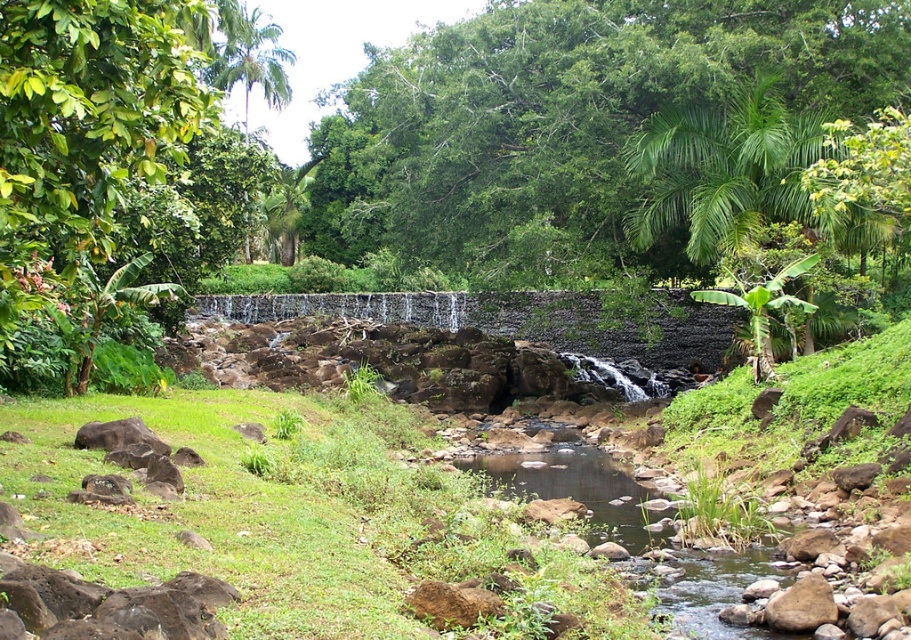
You are standing at the center of the image and want to locate the green leafy tree at upper left. In which direction should you look to find it?

The green leafy tree at upper left is located at point coordinates of 0.256 on the x axis and 0.092 on the y axis. Since the x value is less than 0.5, it is to the left of the center. The y value is also less than 0.5, meaning it is above the center. Therefore, you should look towards the upper left direction to find it.

You are an artist sketching this scene and want to emphasize the scale differences between the green leafy tree at upper center and the green leafy tree at upper left. Which tree should you draw larger in your sketch?

The green leafy tree at upper center should be drawn larger because it is larger in size than the green leafy tree at upper left according to the description.

You are standing in the natural scene and want to take a photo of both the green leafy tree at upper left and the gray stone waterfall at center. Which object should you adjust your camera focus on to ensure both are in sharp focus?

To ensure both the green leafy tree at upper left and the gray stone waterfall at center are in sharp focus, you should focus on the green leafy tree at upper left since it is closer to the viewer than the gray stone waterfall at center.